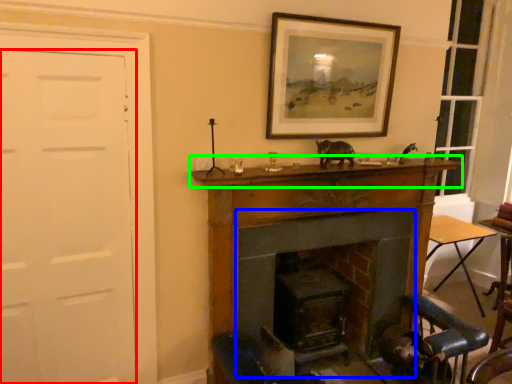
Question: Considering the real-world distances, which object is closest to door (highlighted by a red box)? fireplace (highlighted by a blue box) or mantle (highlighted by a green box).

Choices:
 (A) fireplace
 (B) mantle

Answer: (B)